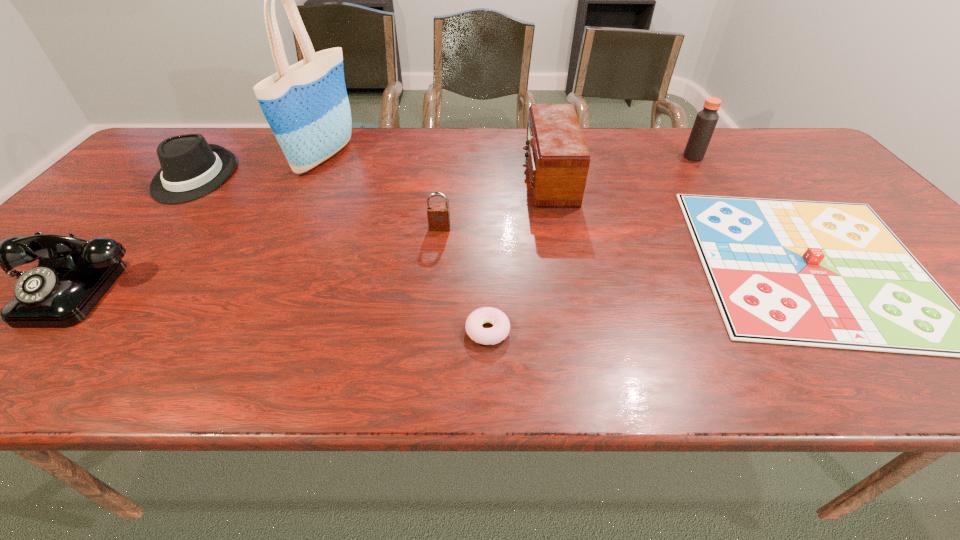
In order to click on object located at the near edge in this screenshot , I will do `click(501, 326)`.

This screenshot has height=540, width=960. Identify the location of object positioned at the left edge. (191, 168).

Locate an element on the screen. The height and width of the screenshot is (540, 960). object that is at the far left corner is located at coordinates (191, 168).

In the image, there is a desktop. Where is `free space at the far edge`? The height and width of the screenshot is (540, 960). free space at the far edge is located at coordinates [x=626, y=132].

Where is `vacant space at the far left corner of the desktop`? vacant space at the far left corner of the desktop is located at coordinates (196, 130).

The image size is (960, 540). Find the location of `vacant area that lies between the fedora and the vinegar`. vacant area that lies between the fedora and the vinegar is located at coordinates (444, 166).

I want to click on unoccupied area between the fedora and the vinegar, so click(x=444, y=166).

This screenshot has height=540, width=960. Identify the location of empty space that is in between the sixth object from right to left and the fifth object from left to right. (407, 244).

You are a GUI agent. You are given a task and a screenshot of the screen. Output one action in this format:
    pyautogui.click(x=<x>, y=<y>)
    Task: Click on the vacant point located between the padlock and the doughnut
    
    Given the screenshot: What is the action you would take?
    pyautogui.click(x=464, y=280)

Locate which object is the closest to the vinegar. Please provide its 2D coordinates. Your answer should be formatted as a tuple, i.e. [(x, y)], where the tuple contains the x and y coordinates of a point satisfying the conditions above.

[(823, 274)]